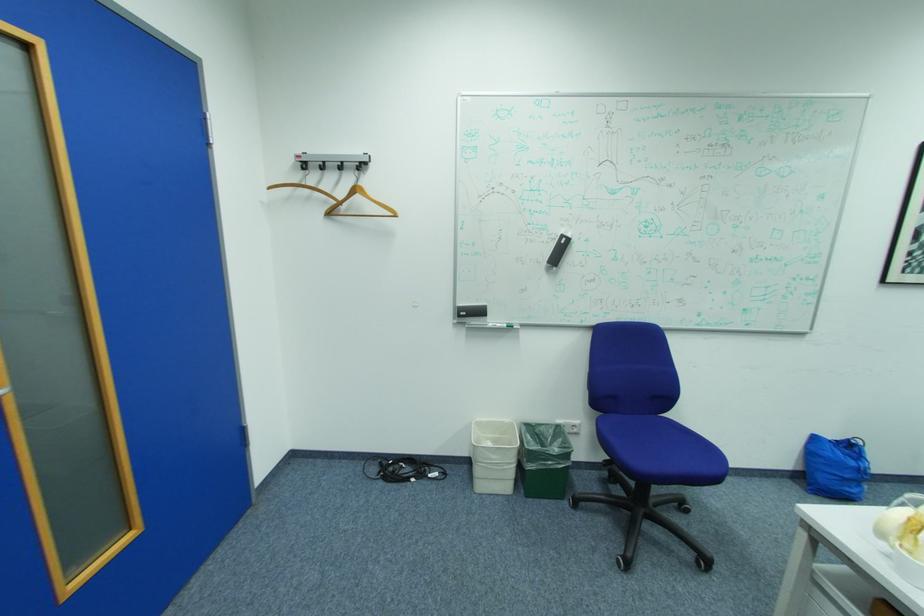
In order to click on blue chair sitting surface in this screenshot , I will do click(643, 432).